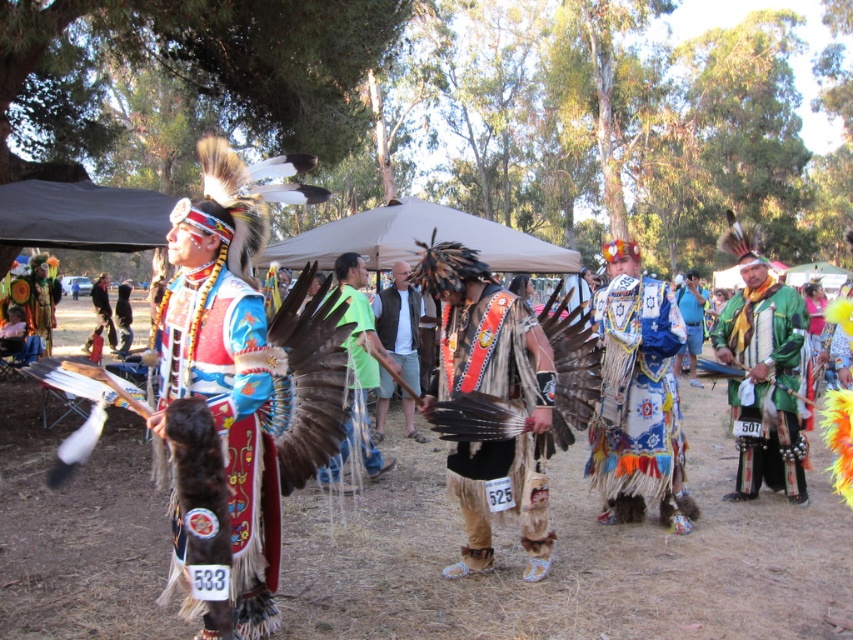
You are a photographer at the event and want to capture both the multicolored feathered vest at center and the matte leather vest at center in a single frame. Since the camera has a limited field of view, will you need to adjust your position to include both?

The multicolored feathered vest at center is wider than the matte leather vest at center. To include both in the frame, you may need to adjust your position to account for the larger width of the multicolored feathered vest at center.

You are attending a cultural festival and notice two vests displayed on a rack at the center of the scene. The multicolored feathered vest at center and the matte leather vest at center. Which vest is positioned higher on the rack?

The matte leather vest at center is positioned higher on the rack because the multicolored feathered vest at center is below it.